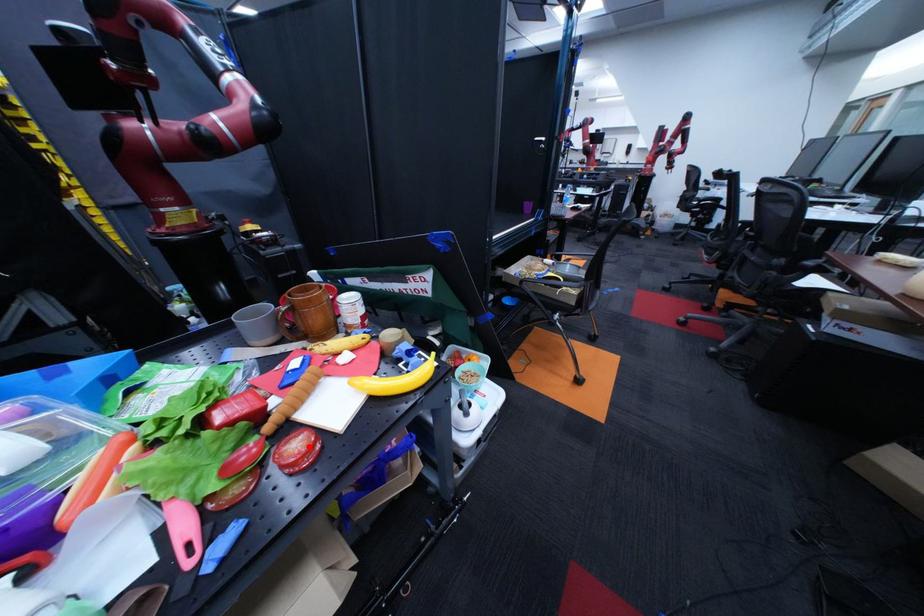
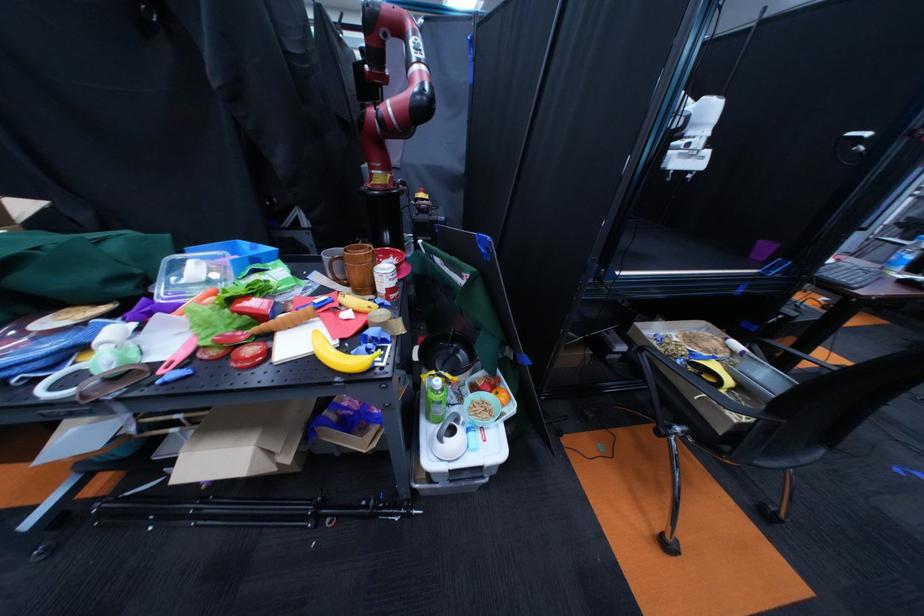
Find the pixel in the second image that matches the highlighted location in the first image.

(263, 351)